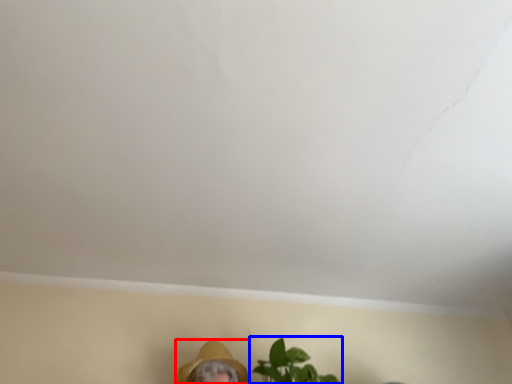
Question: Which object appears closest to the camera in this image, person (highlighted by a red box) or houseplant (highlighted by a blue box)?

Choices:
 (A) person
 (B) houseplant

Answer: (B)